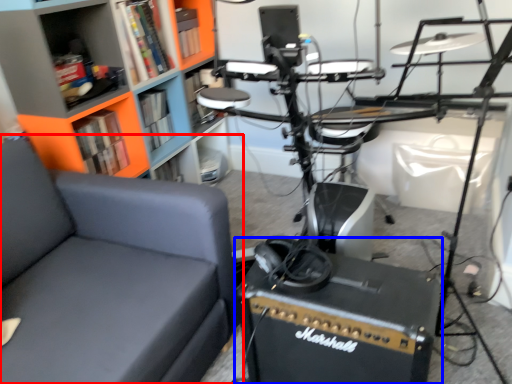
Question: Which object appears closest to the camera in this image, chair (highlighted by a red box) or equipment (highlighted by a blue box)?

Choices:
 (A) chair
 (B) equipment

Answer: (A)